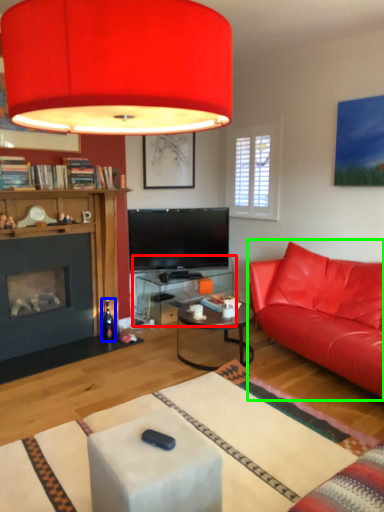
Question: Which is farther away from table (highlighted by a red box)? wine bottle (highlighted by a blue box) or studio couch (highlighted by a green box)?

Choices:
 (A) wine bottle
 (B) studio couch

Answer: (B)